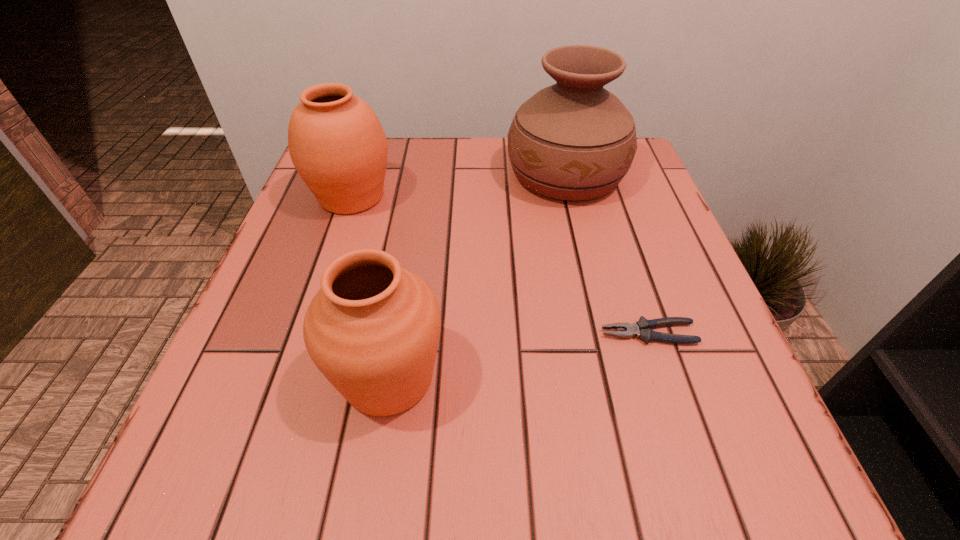
Find the location of a particular element. urn positioned at the right edge is located at coordinates click(574, 140).

Where is `pliers present at the right edge`? The image size is (960, 540). pliers present at the right edge is located at coordinates 642,329.

You are a GUI agent. You are given a task and a screenshot of the screen. Output one action in this format:
    pyautogui.click(x=<x>, y=<y>)
    Task: Click on the object that is positioned at the far left corner
    The height and width of the screenshot is (540, 960).
    Given the screenshot: What is the action you would take?
    pyautogui.click(x=337, y=144)

Locate an element on the screen. The image size is (960, 540). object located in the far right corner section of the desktop is located at coordinates (574, 140).

I want to click on free space at the far edge, so click(x=407, y=174).

In the image, there is a desktop. Find the location of `blank space at the near edge`. blank space at the near edge is located at coordinates (407, 502).

The width and height of the screenshot is (960, 540). I want to click on vacant space at the left edge, so click(264, 343).

What are the coordinates of `vacant area at the right edge of the desktop` in the screenshot? It's located at (607, 212).

Image resolution: width=960 pixels, height=540 pixels. In order to click on vacant space at the near left corner of the desktop in this screenshot , I will do `click(279, 503)`.

In the image, there is a desktop. Identify the location of vacant space at the near right corner. (719, 495).